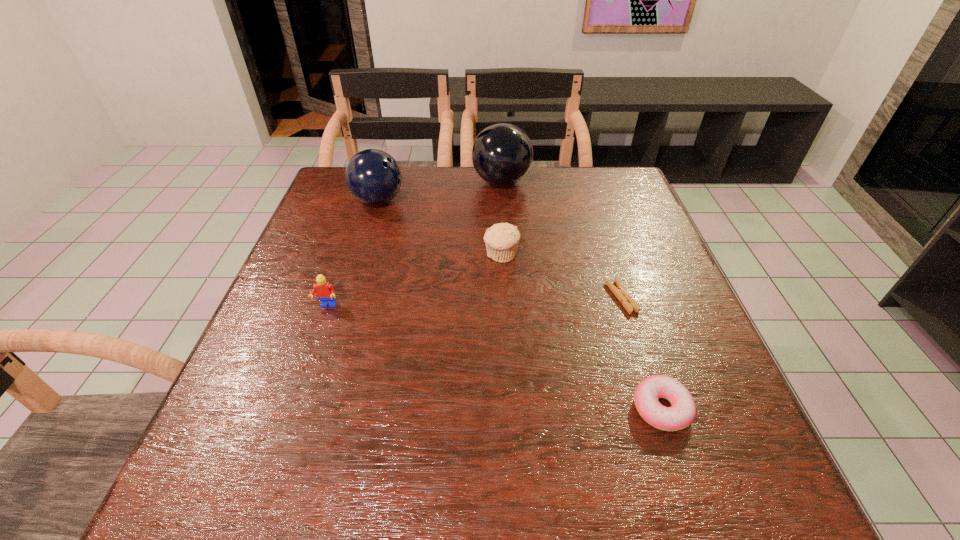
I want to click on free space between the fourth nearest object and the fifth shortest object, so click(x=440, y=228).

Where is `free point between the clothespin and the Lego`? Image resolution: width=960 pixels, height=540 pixels. free point between the clothespin and the Lego is located at coordinates (474, 302).

Where is `free spot between the Lego and the nearest object`? The width and height of the screenshot is (960, 540). free spot between the Lego and the nearest object is located at coordinates (493, 357).

The image size is (960, 540). In order to click on unoccupied area between the nearest object and the muffin in this screenshot , I will do `click(581, 332)`.

Locate an element on the screen. free space between the fourth nearest object and the second tallest object is located at coordinates click(x=440, y=228).

You are a GUI agent. You are given a task and a screenshot of the screen. Output one action in this format:
    pyautogui.click(x=<x>, y=<y>)
    Task: Click on the free space between the right bowling ball and the second tallest object
    Image resolution: width=960 pixels, height=540 pixels.
    Given the screenshot: What is the action you would take?
    pyautogui.click(x=440, y=192)

Select which object appears as the fifth closest to the muffin. Please provide its 2D coordinates. Your answer should be formatted as a tuple, i.e. [(x, y)], where the tuple contains the x and y coordinates of a point satisfying the conditions above.

[(681, 414)]

Locate which object ranks fifth in proximity to the third farthest object. Please provide its 2D coordinates. Your answer should be formatted as a tuple, i.e. [(x, y)], where the tuple contains the x and y coordinates of a point satisfying the conditions above.

[(681, 414)]

Find the location of `vacant region that satisfies the following two spatial constraints: 1. on the surface of the fifth tallest object near the finger holes; 2. on the right side of the shorter bowling ball`. vacant region that satisfies the following two spatial constraints: 1. on the surface of the fifth tallest object near the finger holes; 2. on the right side of the shorter bowling ball is located at coordinates (315, 408).

Locate an element on the screen. The height and width of the screenshot is (540, 960). vacant space that satisfies the following two spatial constraints: 1. on the side of the right bowling ball with the finger holes; 2. on the right side of the shortest object is located at coordinates (509, 298).